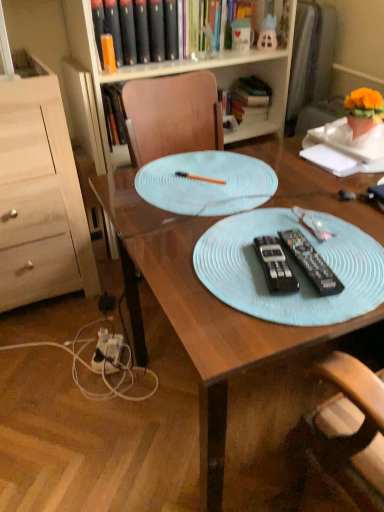
This screenshot has height=512, width=384. I want to click on vacant area that lies to the right of light blue textured placemat at upper center, so click(x=321, y=182).